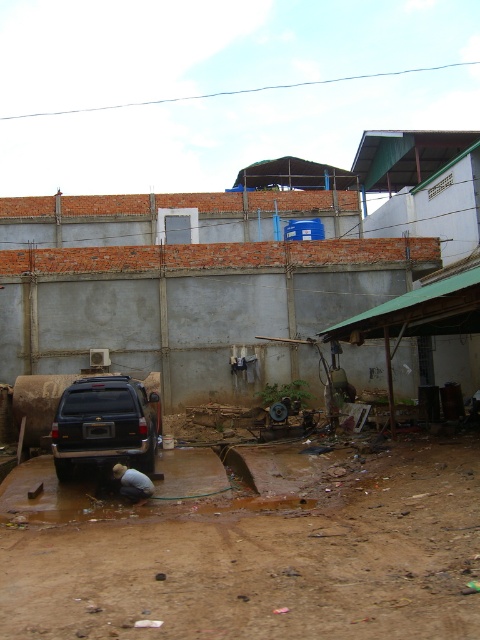
Which is behind, point (156, 602) or point (144, 417)?

The point (144, 417) is more distant.

Between brown dirt track at lower center and dark blue matte jeep at center, which one is positioned higher?

dark blue matte jeep at center

Is point (170, 627) closer to camera compared to point (76, 451)?

Yes, point (170, 627) is in front of point (76, 451).

I want to click on brown dirt track at lower center, so [x=251, y=548].